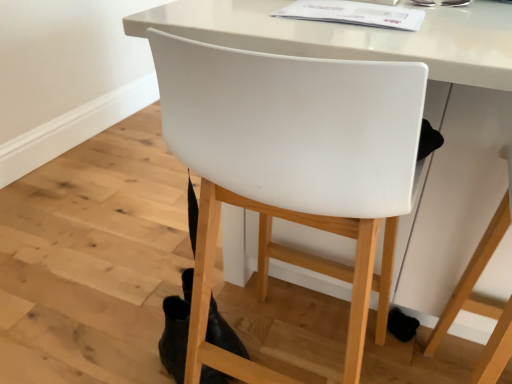
Locate an element on the screen. The width and height of the screenshot is (512, 384). white plastic chair at center is located at coordinates (292, 166).

Describe the element at coordinates (292, 166) in the screenshot. I see `white plastic chair at center` at that location.

The image size is (512, 384). Identify the location of white plastic chair at center. 292,166.